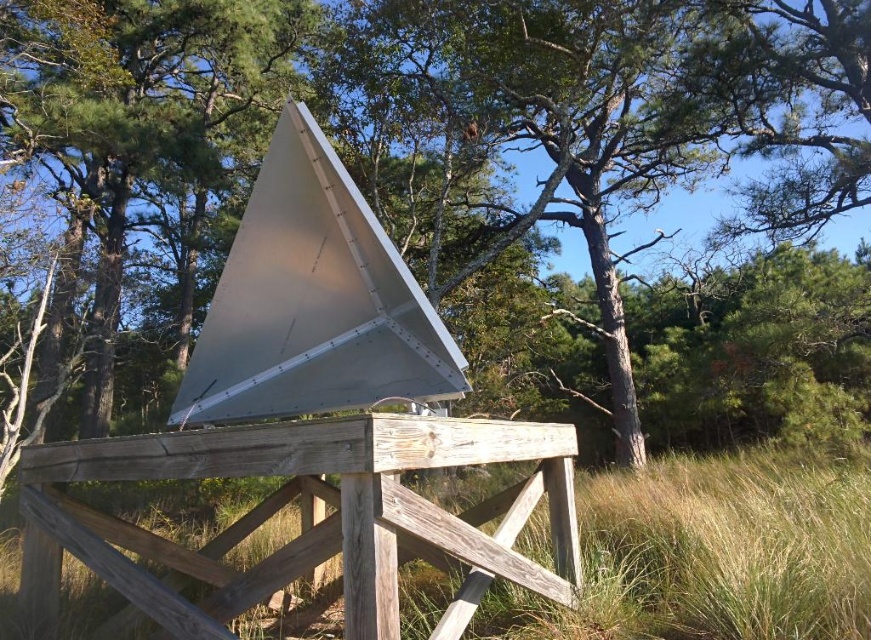
Question: From the image, what is the correct spatial relationship of green leafy tree at upper center in relation to grassy brown at center?

Choices:
 (A) below
 (B) above

Answer: (B)

Question: Which of the following is the closest to the observer?

Choices:
 (A) grassy brown at center
 (B) green leafy tree at upper center

Answer: (A)

Question: Where is green leafy tree at upper center located in relation to grassy brown at center in the image?

Choices:
 (A) left
 (B) right

Answer: (B)

Question: Which point appears closest to the camera in this image?

Choices:
 (A) (696, 568)
 (B) (608, 108)

Answer: (A)

Question: Is green leafy tree at upper center further to camera compared to grassy brown at center?

Choices:
 (A) no
 (B) yes

Answer: (B)